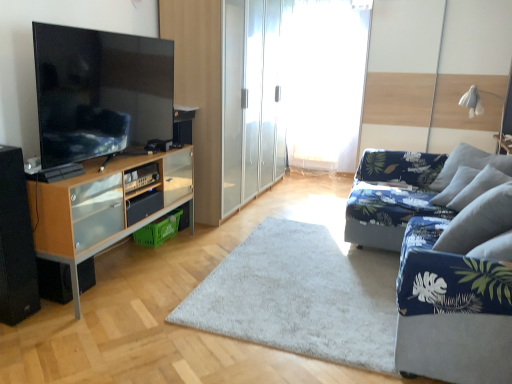
Question: Is transparent glass wardrobe at center directly adjacent to white sheer curtain at center?

Choices:
 (A) no
 (B) yes

Answer: (A)

Question: Does transparent glass wardrobe at center come in front of white sheer curtain at center?

Choices:
 (A) yes
 (B) no

Answer: (A)

Question: Can we say transparent glass wardrobe at center lies outside white sheer curtain at center?

Choices:
 (A) yes
 (B) no

Answer: (A)

Question: Can you confirm if transparent glass wardrobe at center is smaller than white sheer curtain at center?

Choices:
 (A) no
 (B) yes

Answer: (A)

Question: From a real-world perspective, is transparent glass wardrobe at center below white sheer curtain at center?

Choices:
 (A) yes
 (B) no

Answer: (A)

Question: Do you think wooden cabinet at left is within matte black tv at left, or outside of it?

Choices:
 (A) inside
 (B) outside

Answer: (B)

Question: Considering the relative positions of wooden cabinet at left and matte black tv at left in the image provided, is wooden cabinet at left to the left or to the right of matte black tv at left?

Choices:
 (A) right
 (B) left

Answer: (B)

Question: Considering their positions, is wooden cabinet at left located in front of or behind matte black tv at left?

Choices:
 (A) front
 (B) behind

Answer: (B)

Question: From a real-world perspective, is wooden cabinet at left above or below matte black tv at left?

Choices:
 (A) below
 (B) above

Answer: (A)

Question: In the image, is gray fabric pillow at right positioned in front of or behind blue fabric couch at right?

Choices:
 (A) behind
 (B) front

Answer: (A)

Question: In terms of width, does gray fabric pillow at right look wider or thinner when compared to blue fabric couch at right?

Choices:
 (A) thin
 (B) wide

Answer: (A)

Question: Is gray fabric pillow at right inside or outside of blue fabric couch at right?

Choices:
 (A) outside
 (B) inside

Answer: (A)

Question: Visually, is gray fabric pillow at right positioned to the left or to the right of blue fabric couch at right?

Choices:
 (A) left
 (B) right

Answer: (B)

Question: Is black matte speaker at lower left, the 2th speaker when ordered from back to front, taller or shorter than matte black tv at left?

Choices:
 (A) tall
 (B) short

Answer: (A)

Question: Considering the positions of black matte speaker at lower left, the 2th speaker when ordered from back to front, and matte black tv at left in the image, is black matte speaker at lower left, the 2th speaker when ordered from back to front, bigger or smaller than matte black tv at left?

Choices:
 (A) small
 (B) big

Answer: (A)